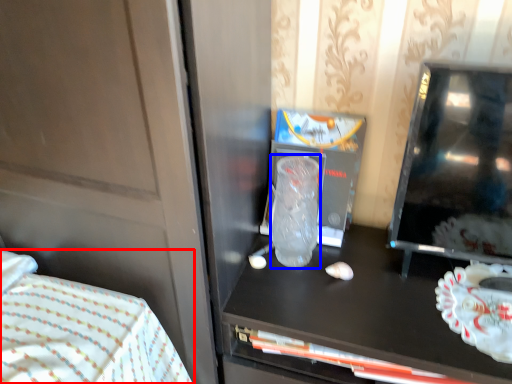
Question: Among these objects, which one is nearest to the camera, bed (highlighted by a red box) or glass vase (highlighted by a blue box)?

Choices:
 (A) bed
 (B) glass vase

Answer: (A)